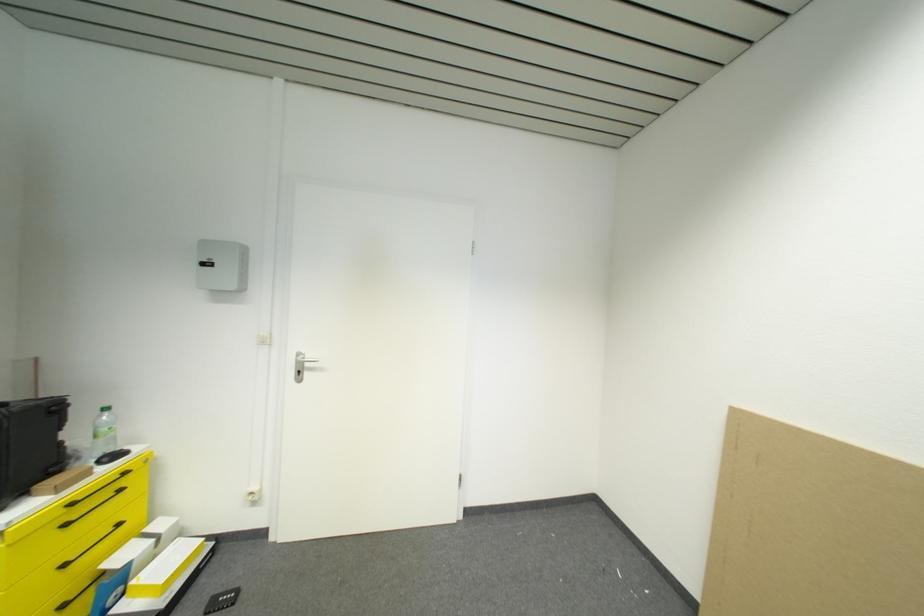
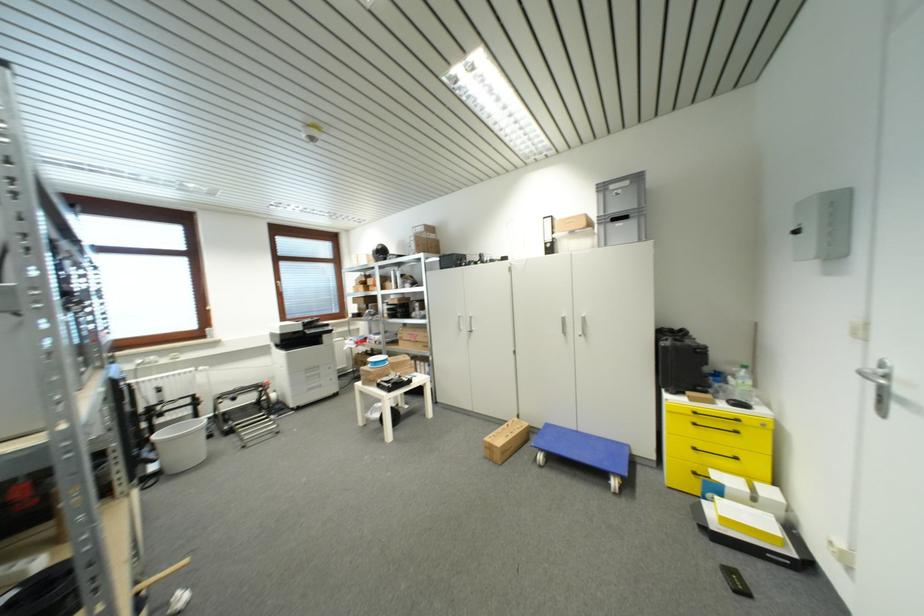
Where in the second image is the point corresponding to (302,374) from the first image?

(884, 400)